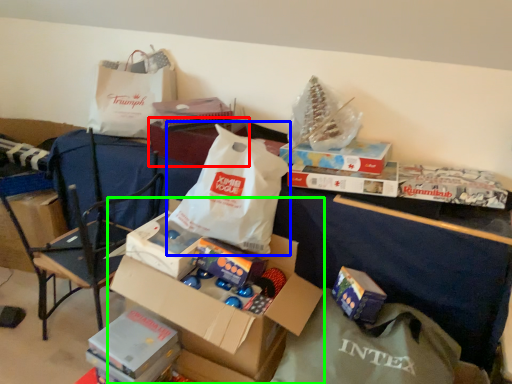
Question: Which object is positioned farthest from storage box (highlighted by a red box)? Select from grocery bag (highlighted by a blue box) and box (highlighted by a green box).

Choices:
 (A) grocery bag
 (B) box

Answer: (B)